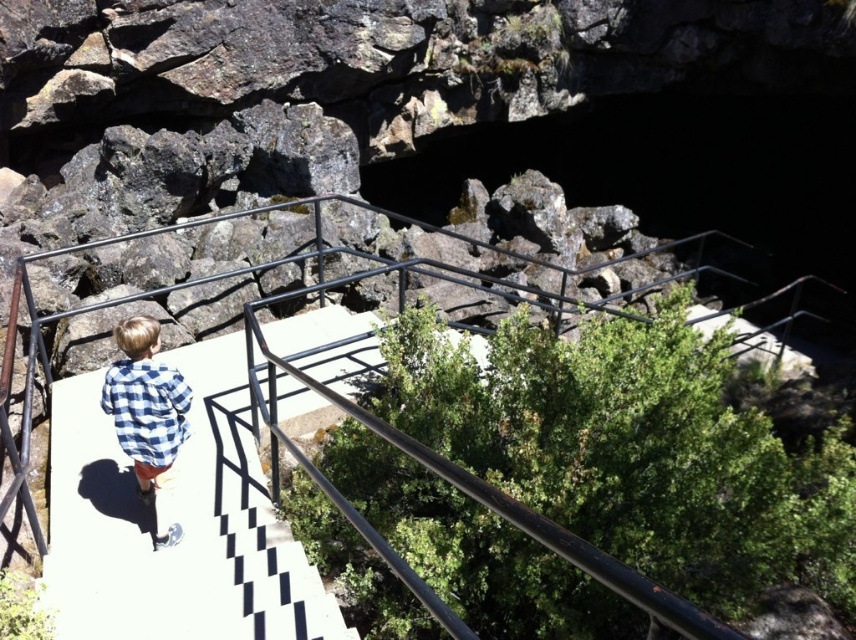
A child is walking on the white checkered pavement at center and wants to reach the black metal railing at center. The child is currently 7.42 feet away from the railing. If the child takes 3 steps of 2 feet each, will they reach the railing?

The distance between the white checkered pavement at center and the black metal railing at center is 7.42 feet. The child takes 3 steps of 2 feet each, totaling 6 feet. Since 6 feet is less than 7.42 feet, the child will not reach the black metal railing at center.

You are a drone operator trying to capture a photo of the child walking on the platform. You need to position your drone between the two points, point [88,451] and point [181,417]. Which point should you place the drone closer to in order to ensure the child is in focus?

You should place the drone closer to point [88,451] because it is closer to the camera than point [181,417], ensuring better focus on the child.

You are a parent watching your child on the platform. You notice the black metal railing at center and the blue checkered shirt at lower left. Which object takes up more space in the image?

The blue checkered shirt at lower left takes up more space in the image than the black metal railing at center because the black metal railing at center occupies less space than blue checkered shirt at lower left.